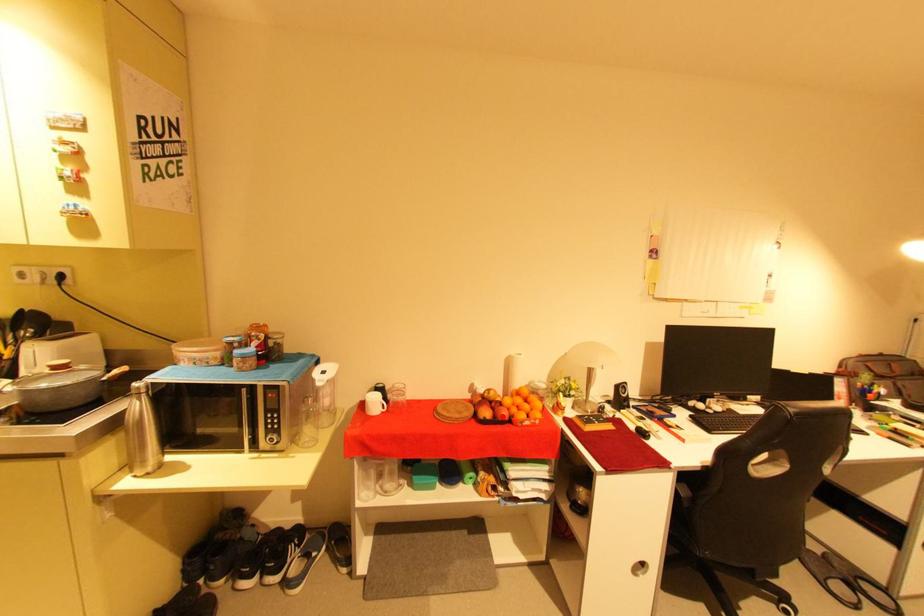
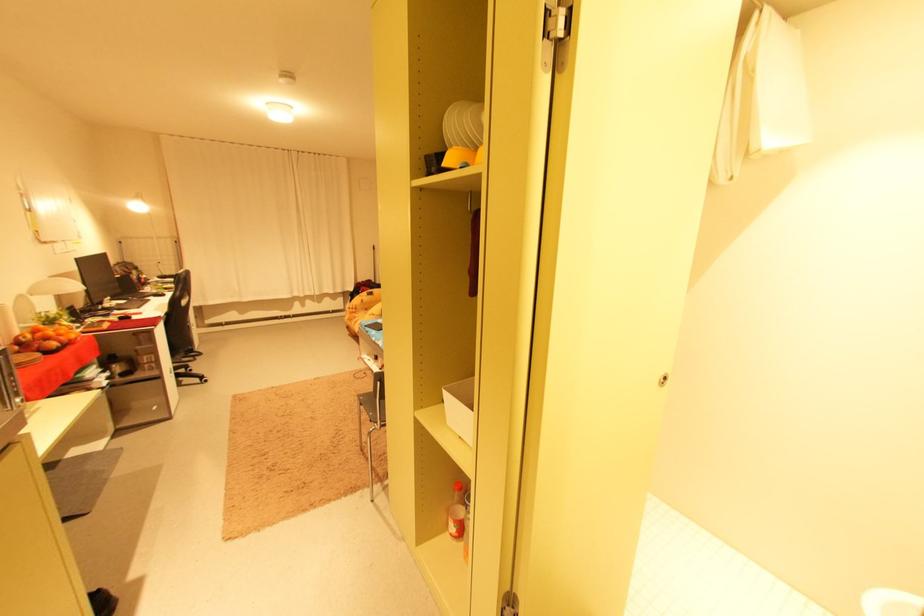
Question: I am providing you with two images of the same scene from different viewpoints. Given a red point in image1, look at the same physical point in image2. Is it:

Choices:
 (A) Closer to the viewpoint
 (B) Farther from the viewpoint

Answer: (B)